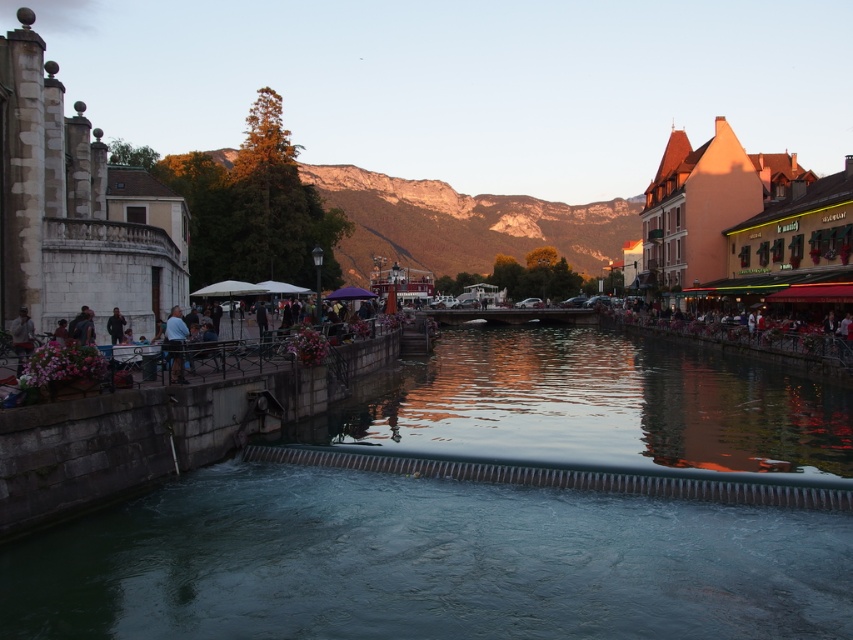
You are standing at the riverside and want to take a photo of the smooth concrete wall at center and the matte orange building at right. If your camera has a maximum focus range of 40 meters, will both objects be in focus?

The smooth concrete wall at center is 40.77 meters away from matte orange building at right. Since the distance between them is greater than the camera maximum focus range of 40 meters, both objects cannot be in focus at the same time.

You are standing on the riverside and want to take a photo of the smooth concrete wall at center and the matte orange building at right. Which object should you point your camera towards first if you want to capture both in one frame without moving the camera?

You should point your camera towards the smooth concrete wall at center first because it is located below the matte orange building at right, so capturing it lower in the frame will allow both objects to be included without moving the camera.